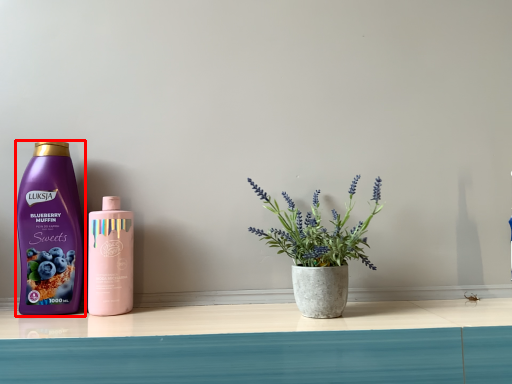
Question: From the image's perspective, where is bottle (annotated by the red box) located relative to bottle?

Choices:
 (A) below
 (B) above

Answer: (B)